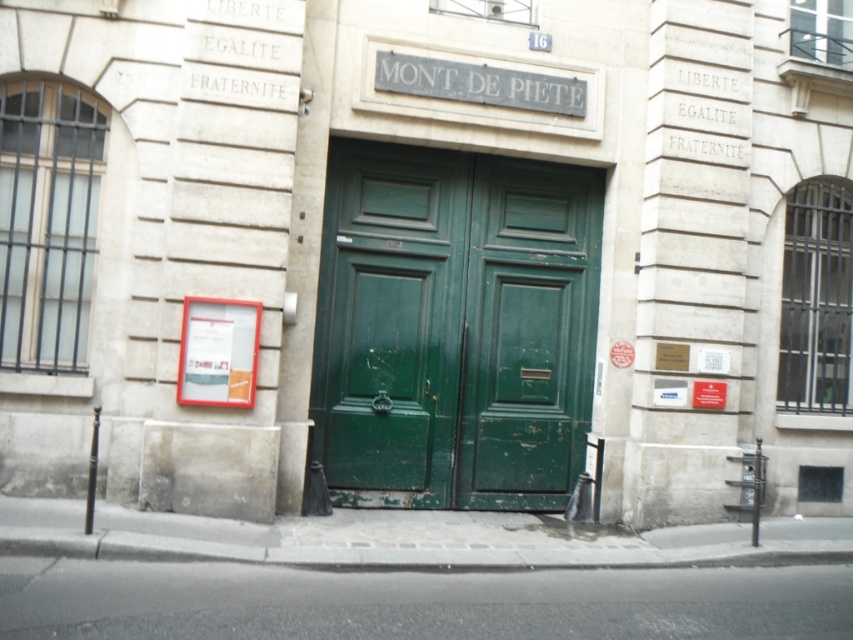
Consider the image. Does green matte door at center have a greater height compared to green wood door at center?

Correct, green matte door at center is much taller as green wood door at center.

Does green matte door at center have a larger size compared to green wood door at center?

Indeed, green matte door at center has a larger size compared to green wood door at center.

Who is more distant from viewer, (491,349) or (590,406)?

The point (590,406) is behind.

Locate an element on the screen. The image size is (853, 640). green matte door at center is located at coordinates (454, 326).